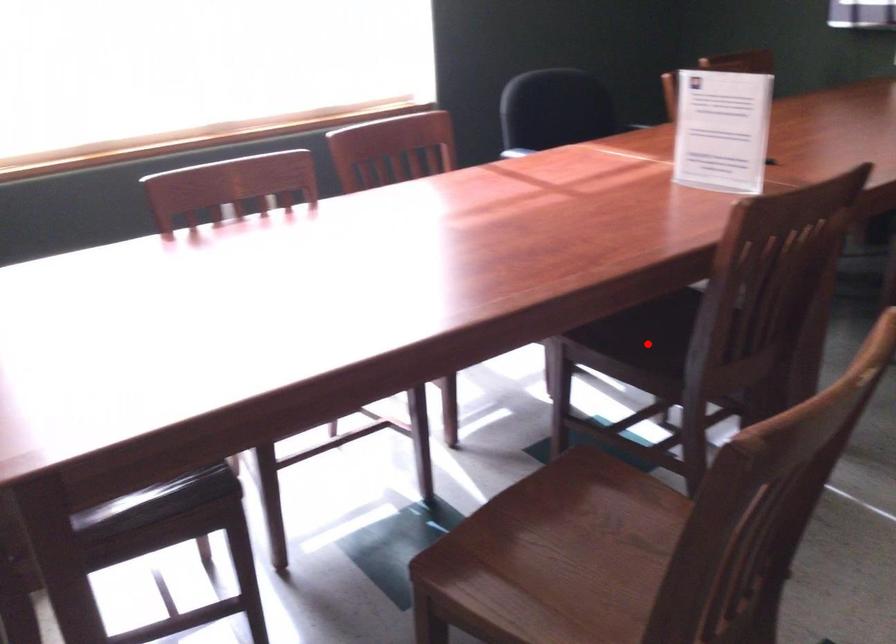
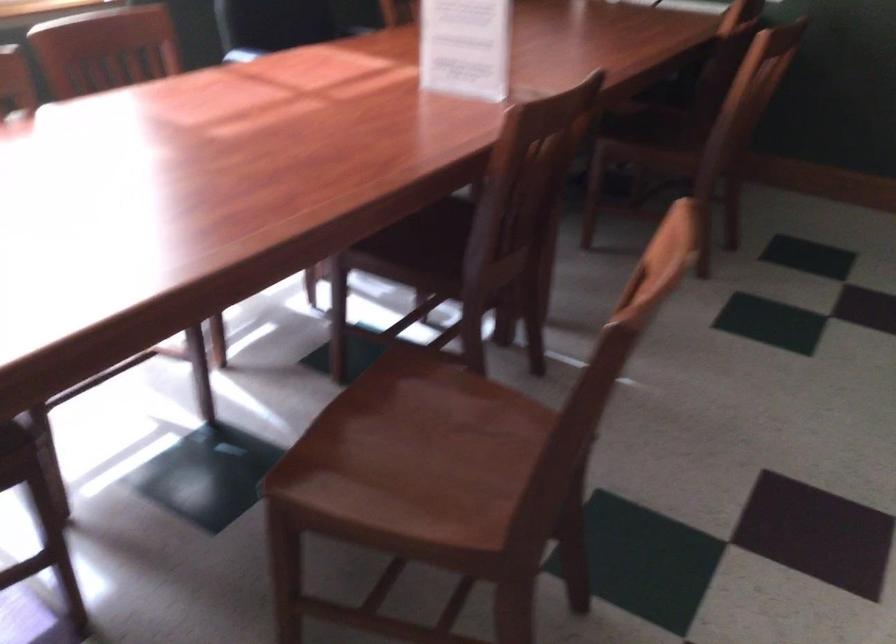
Where in the second image is the point corresponding to the highlighted location from the first image?

(418, 247)